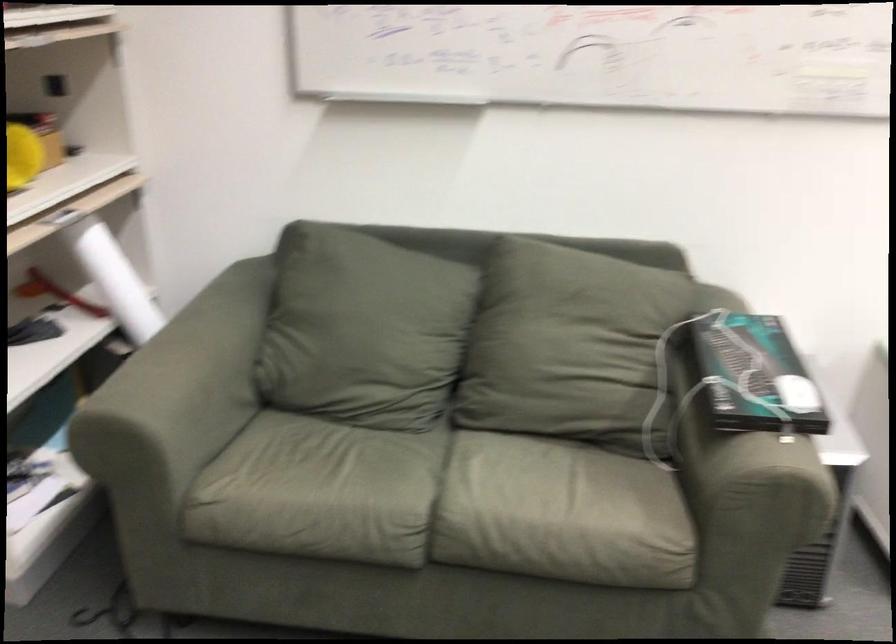
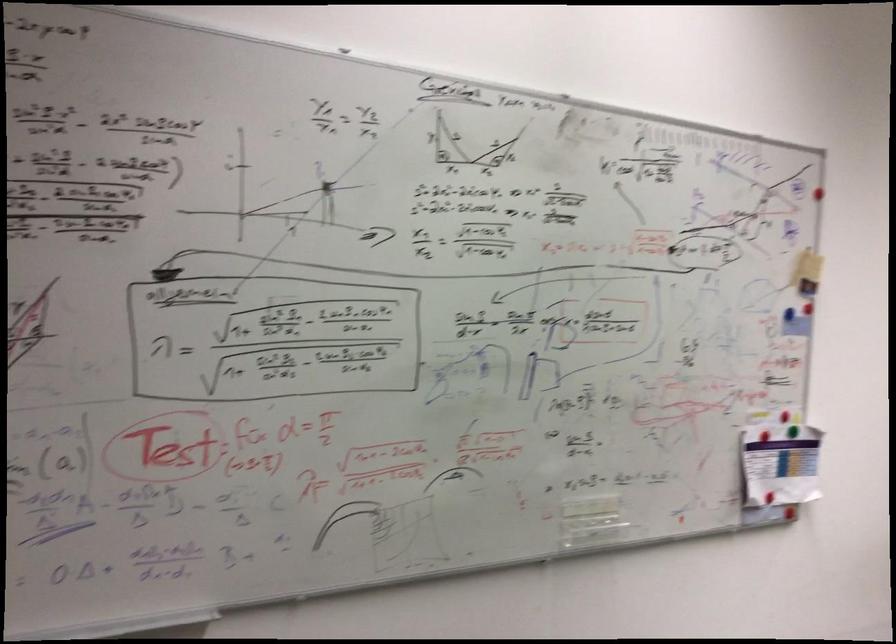
The first image is from the beginning of the video and the second image is from the end. How did the camera likely rotate when shooting the video?

The camera rotated toward right-up.